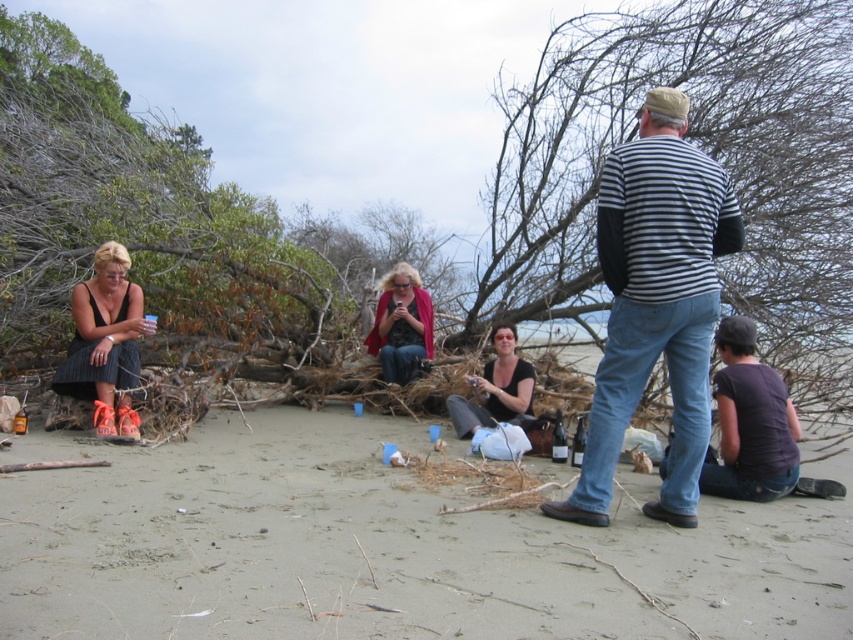
Question: Which point is closer to the camera taking this photo?

Choices:
 (A) (152, 508)
 (B) (480, 376)

Answer: (A)

Question: Is smooth sand at center in front of matte pink coat at center?

Choices:
 (A) yes
 (B) no

Answer: (A)

Question: Is matte black tank top at left smaller than matte pink coat at center?

Choices:
 (A) yes
 (B) no

Answer: (A)

Question: Which is nearer to the matte black tank top at left?

Choices:
 (A) matte black shirt at center
 (B) striped cotton shirt at center
 (C) smooth sand at center

Answer: (A)

Question: Which point is closer to the camera?

Choices:
 (A) matte black tank top at left
 (B) matte black shirt at center
 (C) matte pink coat at center

Answer: (A)

Question: Where is smooth sand at center located in relation to matte pink coat at center in the image?

Choices:
 (A) right
 (B) left

Answer: (A)